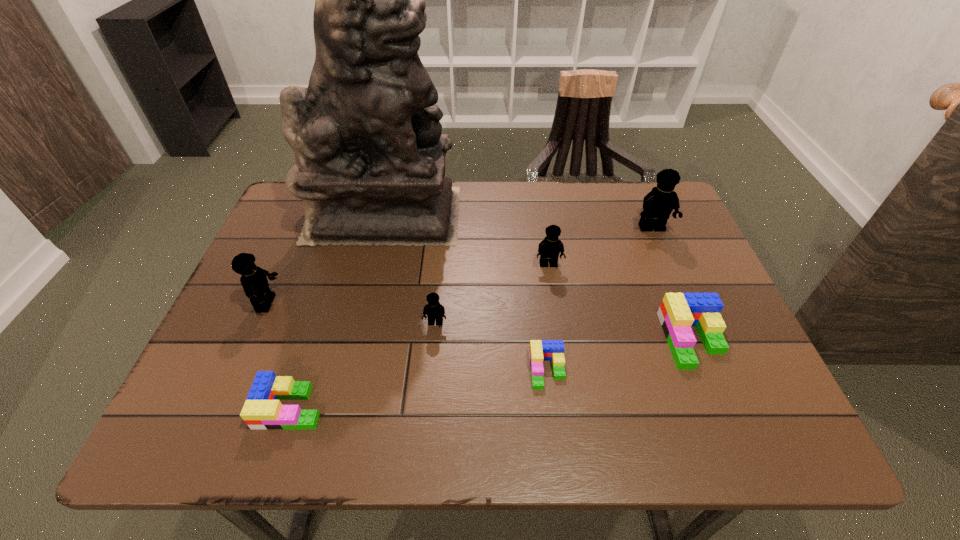
The height and width of the screenshot is (540, 960). I want to click on free space located on the back of the third shortest Lego, so click(655, 248).

Find the location of `vacant space positioned 0.170m on the back of the second shortest Lego`. vacant space positioned 0.170m on the back of the second shortest Lego is located at coordinates (319, 319).

The image size is (960, 540). I want to click on vacant region located 0.220m on the back of the smallest green Lego, so click(536, 277).

The image size is (960, 540). What are the coordinates of `sculpture that is at the far edge` in the screenshot? It's located at (369, 166).

I want to click on Lego that is at the far edge, so click(x=658, y=204).

Locate an element on the screen. object at the near edge is located at coordinates (262, 410).

Where is `sculpture present at the left edge`? The height and width of the screenshot is (540, 960). sculpture present at the left edge is located at coordinates (369, 166).

What are the coordinates of `object located in the far left corner section of the desktop` in the screenshot? It's located at (369, 166).

The width and height of the screenshot is (960, 540). Find the location of `object at the near left corner`. object at the near left corner is located at coordinates (262, 410).

Where is `object present at the far right corner`? The image size is (960, 540). object present at the far right corner is located at coordinates pyautogui.click(x=658, y=204).